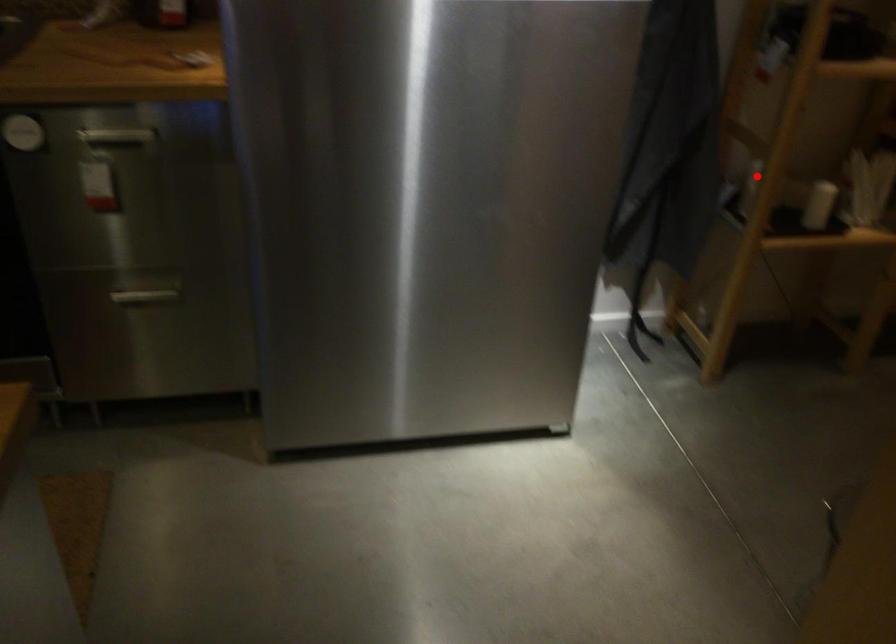
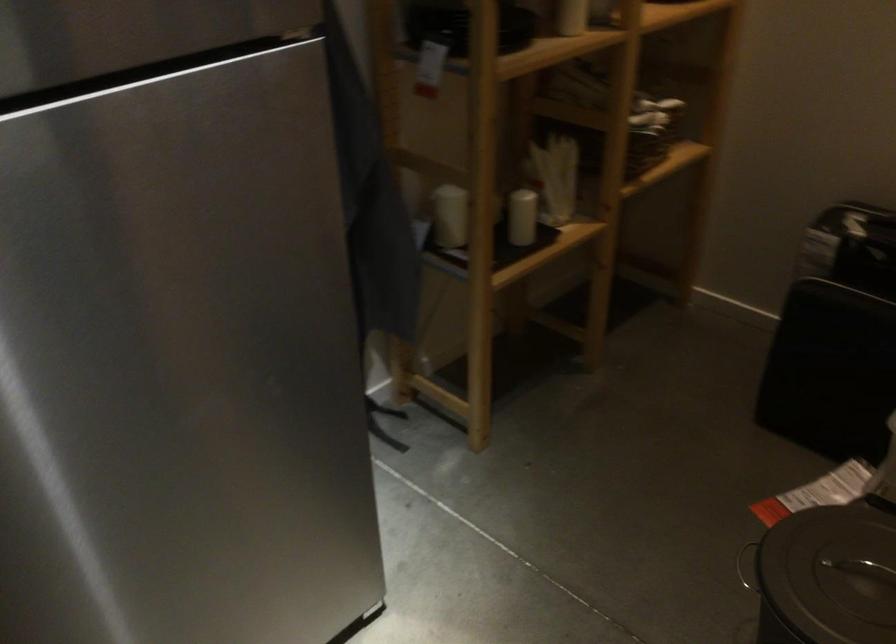
Find the pixel in the second image that matches the highlighted location in the first image.

(450, 216)